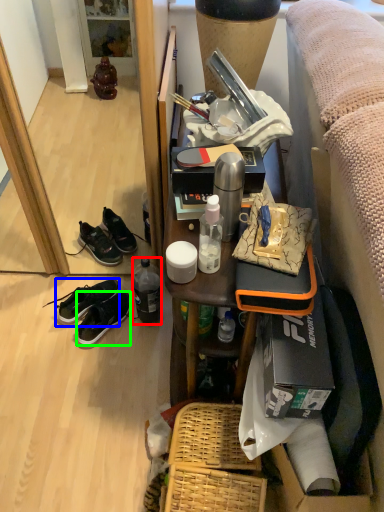
Question: Which object is the farthest from bottle (highlighted by a red box)? Choose among these: shoe (highlighted by a blue box) or sneakers (highlighted by a green box).

Choices:
 (A) shoe
 (B) sneakers

Answer: (A)